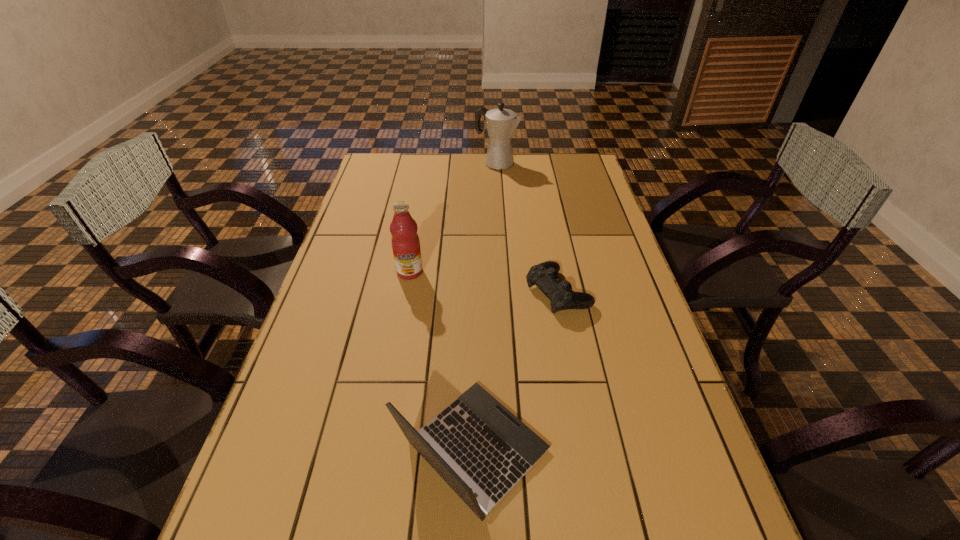
This screenshot has height=540, width=960. I want to click on empty location between the fruit juice and the laptop_computer, so click(x=442, y=361).

You are a GUI agent. You are given a task and a screenshot of the screen. Output one action in this format:
    pyautogui.click(x=<x>, y=<y>)
    Task: Click on the free area in between the laptop_computer and the farthest object
    
    Given the screenshot: What is the action you would take?
    [x=485, y=307]

What are the coordinates of `empty space that is in between the fruit juice and the shortest object` in the screenshot? It's located at (484, 282).

In order to click on free space between the laptop_computer and the farthest object in this screenshot , I will do `click(485, 307)`.

The image size is (960, 540). I want to click on vacant region between the laptop_computer and the shortest object, so click(x=516, y=371).

I want to click on object identified as the closest to the coffeepot, so click(x=405, y=241).

Locate which object ranks third in proximity to the control. Please provide its 2D coordinates. Your answer should be formatted as a tuple, i.e. [(x, y)], where the tuple contains the x and y coordinates of a point satisfying the conditions above.

[(501, 123)]

The image size is (960, 540). I want to click on free space that satisfies the following two spatial constraints: 1. on the label of the control; 2. on the right side of the fruit juice, so click(x=406, y=292).

This screenshot has width=960, height=540. I want to click on vacant region that satisfies the following two spatial constraints: 1. on the label of the fruit juice; 2. on the left side of the shortest object, so click(406, 292).

Where is `free spot that satisfies the following two spatial constraints: 1. on the front side of the farthest object; 2. at the front screen of the laptop_computer`? This screenshot has width=960, height=540. free spot that satisfies the following two spatial constraints: 1. on the front side of the farthest object; 2. at the front screen of the laptop_computer is located at coordinates (514, 450).